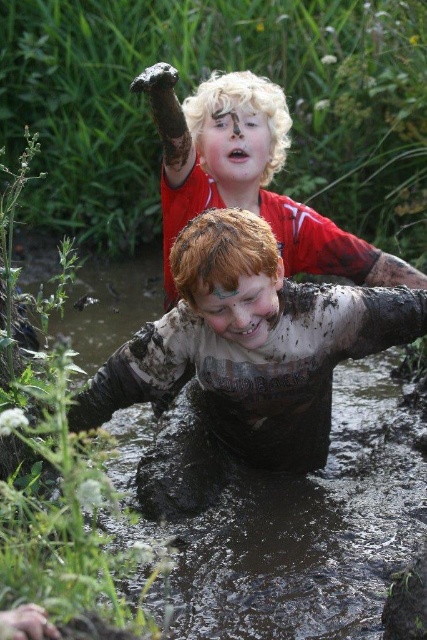
Which of these two, muddy water at lower center or blonde hair at upper center, stands taller?

Standing taller between the two is muddy water at lower center.

Can you confirm if muddy water at lower center is smaller than blonde hair at upper center?

Actually, muddy water at lower center might be larger than blonde hair at upper center.

Is point (263, 484) positioned in front of point (248, 129)?

Yes, it is in front of point (248, 129).

Find the location of `muddy water at lower center`. muddy water at lower center is located at coordinates (277, 516).

Which is more to the right, muddy water at lower center or reddish-brown hair at center?

Positioned to the right is muddy water at lower center.

At what (x,y) coordinates should I click in order to perform the action: click on muddy water at lower center. Please return your answer as a coordinate pair (x, y). Looking at the image, I should click on (277, 516).

This screenshot has width=427, height=640. Find the location of `muddy water at lower center`. muddy water at lower center is located at coordinates (277, 516).

Is point (254, 492) positioned behind point (208, 195)?

No, (254, 492) is in front of (208, 195).

Does point (81, 332) lie behind point (195, 209)?

That is True.

Identify the location of muddy water at lower center. The image size is (427, 640). (277, 516).